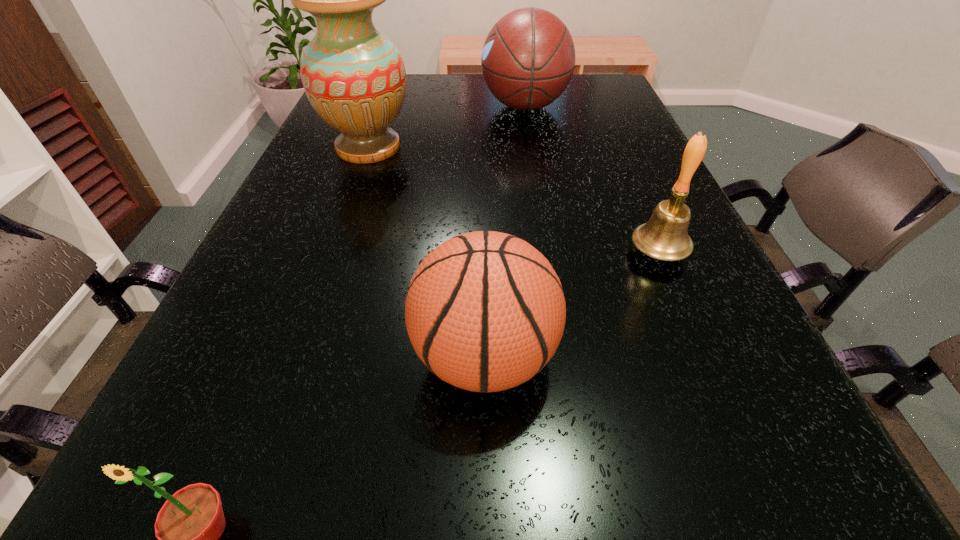
This screenshot has width=960, height=540. In the image, there is a desktop. What are the coordinates of `free region at the right edge` in the screenshot? It's located at tap(693, 288).

Identify the location of vacant space at the far right corner of the desktop. The width and height of the screenshot is (960, 540). (612, 78).

Identify the location of empty space between the third nearest object and the taller basketball. The width and height of the screenshot is (960, 540). (591, 180).

The height and width of the screenshot is (540, 960). I want to click on empty space between the nearer basketball and the farther basketball, so click(505, 232).

You are a GUI agent. You are given a task and a screenshot of the screen. Output one action in this format:
    pyautogui.click(x=<x>, y=<y>)
    Task: Click on the free space between the farther basketball and the vase
    This screenshot has height=540, width=960.
    Given the screenshot: What is the action you would take?
    tap(446, 127)

You are a GUI agent. You are given a task and a screenshot of the screen. Output one action in this format:
    pyautogui.click(x=<x>, y=<y>)
    Task: Click on the free space between the farther basketball and the bell
    
    Given the screenshot: What is the action you would take?
    pyautogui.click(x=591, y=180)

Locate an element on the screen. free point between the third nearest object and the nearer basketball is located at coordinates (571, 305).

Where is `free space between the taller basketball and the vase`? free space between the taller basketball and the vase is located at coordinates click(446, 127).

Find the location of a particular element. The height and width of the screenshot is (540, 960). object that is the fourth closest to the third nearest object is located at coordinates (188, 526).

At what (x,y) coordinates should I click in order to perform the action: click on object that stands as the second closest to the farther basketball. Please return your answer as a coordinate pair (x, y). This screenshot has height=540, width=960. Looking at the image, I should click on (665, 236).